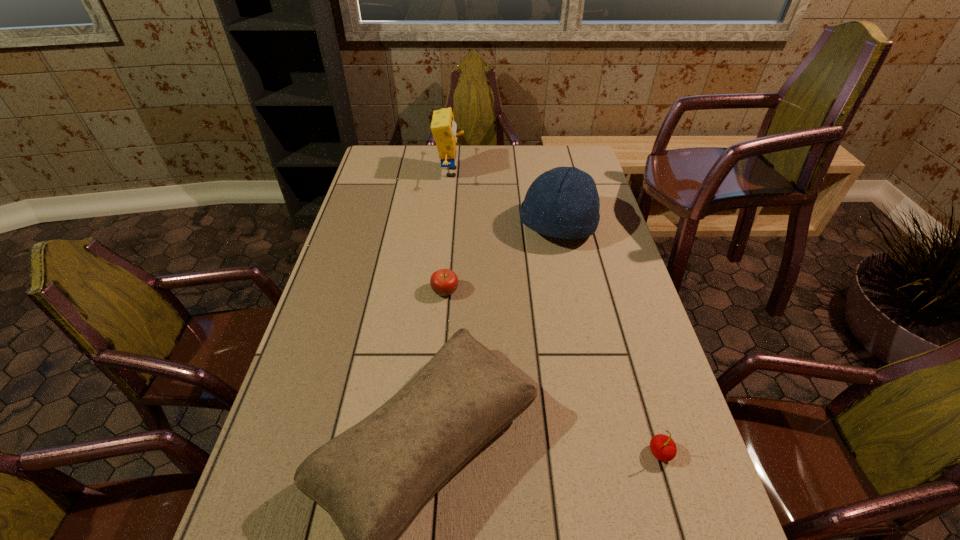
The image size is (960, 540). Identify the location of object located at the far edge. (443, 127).

This screenshot has width=960, height=540. I want to click on skullcap located in the right edge section of the desktop, so click(563, 202).

Where is `cherry that is at the right edge`? cherry that is at the right edge is located at coordinates (663, 447).

This screenshot has height=540, width=960. What are the coordinates of `vacant area at the far edge` in the screenshot? It's located at coord(412,152).

Identify the location of free space at the left edge. (295, 401).

In the image, there is a desktop. Where is `free space at the right edge`? This screenshot has height=540, width=960. free space at the right edge is located at coordinates (684, 526).

The width and height of the screenshot is (960, 540). Identify the location of vacant space at the far left corner of the desktop. (x=388, y=149).

The image size is (960, 540). I want to click on vacant region at the far right corner of the desktop, so click(x=573, y=151).

You are a GUI agent. You are given a task and a screenshot of the screen. Output one action in this format:
    pyautogui.click(x=<x>, y=<y>)
    Task: Click on the empty location between the second shortest object and the shortest object
    
    Given the screenshot: What is the action you would take?
    pyautogui.click(x=553, y=372)

You are a GUI agent. You are given a task and a screenshot of the screen. Output one action in this format:
    pyautogui.click(x=<x>, y=<y>)
    Task: Click on the vacant area that lies between the fourth shortest object and the cherry
    
    Given the screenshot: What is the action you would take?
    pyautogui.click(x=609, y=340)